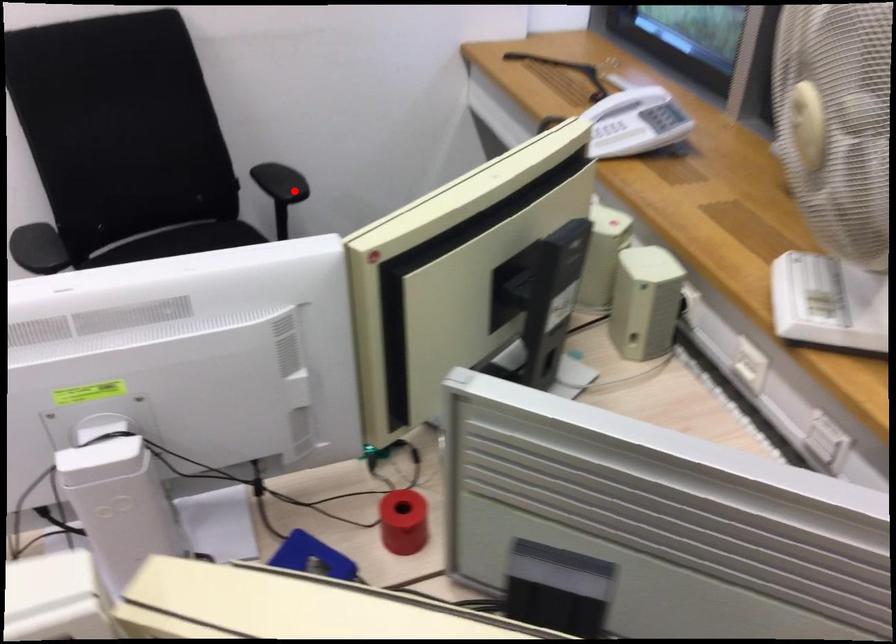
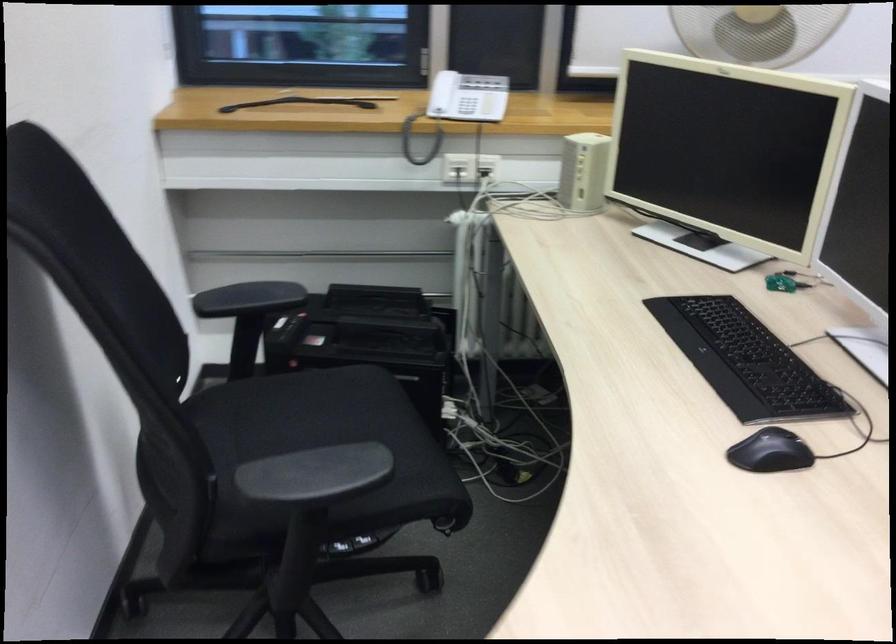
In the second image, find the point that corresponds to the highlighted location in the first image.

(247, 299)